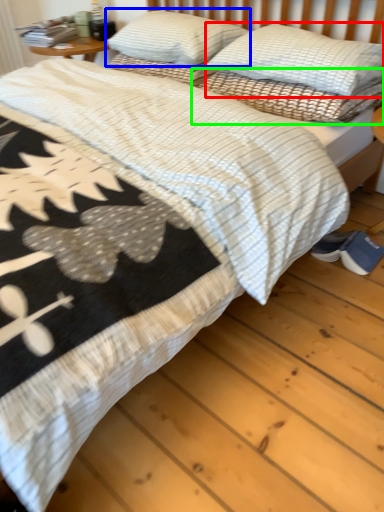
Question: Based on their relative distances, which object is farther from pillow (highlighted by a red box)? Choose from pillow (highlighted by a blue box) and pillow (highlighted by a green box).

Choices:
 (A) pillow
 (B) pillow

Answer: (A)